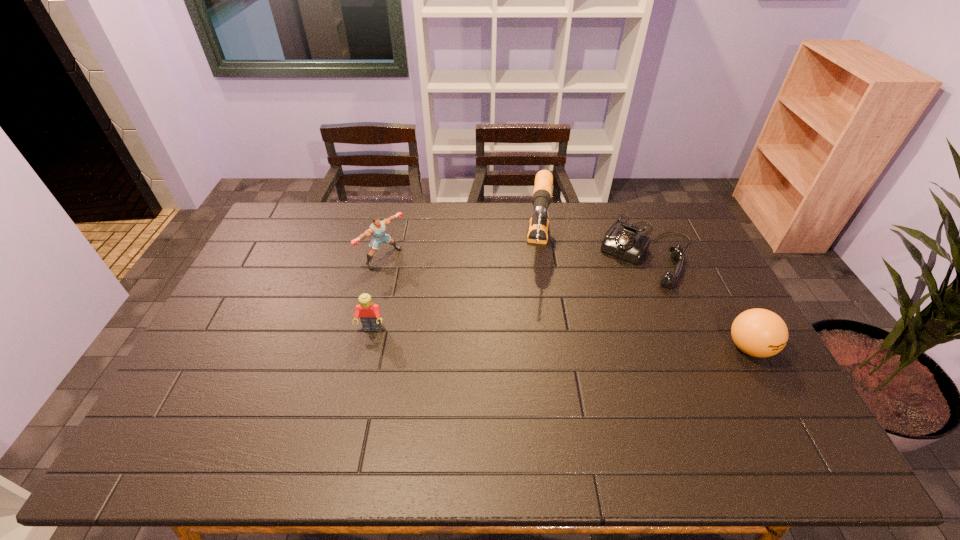
This screenshot has height=540, width=960. In order to click on Lego in this screenshot , I will do `click(369, 313)`.

Locate an element on the screen. ping-pong ball is located at coordinates (758, 332).

Identify the location of telephone. Image resolution: width=960 pixels, height=540 pixels. (625, 242).

Image resolution: width=960 pixels, height=540 pixels. Find the location of `drill`. drill is located at coordinates (538, 228).

Where is `the tallest object`? This screenshot has height=540, width=960. the tallest object is located at coordinates (538, 228).

Find the location of a particular element. The width and height of the screenshot is (960, 540). the fourth shortest object is located at coordinates (377, 229).

Image resolution: width=960 pixels, height=540 pixels. In order to click on vacant space located 0.070m on the face of the Lego in this screenshot , I will do `click(366, 355)`.

Where is `vacant region located 0.060m on the side with brand of the ping-pong ball`? This screenshot has height=540, width=960. vacant region located 0.060m on the side with brand of the ping-pong ball is located at coordinates (770, 387).

You are a GUI agent. You are given a task and a screenshot of the screen. Output one action in this format:
    pyautogui.click(x=<x>, y=<y>)
    Task: Click on the free location located on the dial of the telephone
    
    Given the screenshot: What is the action you would take?
    pyautogui.click(x=600, y=341)

I want to click on free space located 0.190m on the dial of the telephone, so [x=612, y=321].